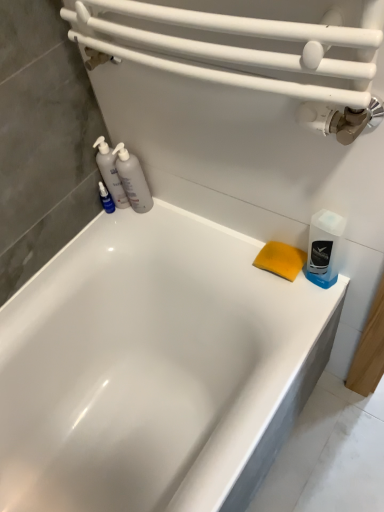
Identify the location of empty space that is in between blue translucent bottle at left and blue translucent bottle at right, which is counted as the third cleaning product, starting from the left. This screenshot has height=512, width=384. (198, 239).